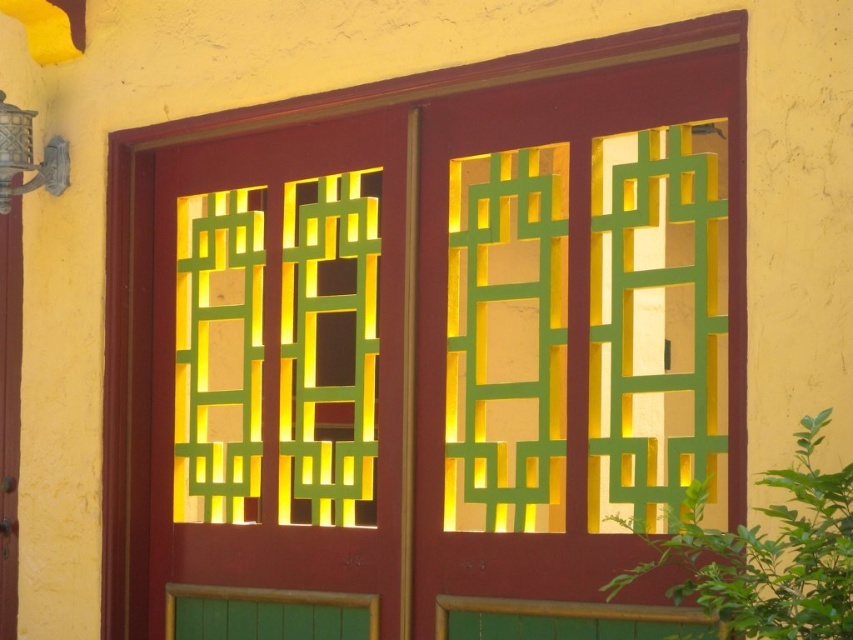
You are standing in front of the yellow wall with the wooden doors. You need to hang a small picture frame on the wall between the matte wood screen door at center and the metallic wall sconce at upper left. Is there enough space between them to place the frame?

The matte wood screen door at center is positioned under the metallic wall sconce at upper left, so there is space between them to place the frame.

You are standing in front of the red doors with yellow walls and see two points marked on the doors. The first point is at coordinate point (480,189) and the second is at point (4,179). Which point is closer to you?

Point (480,189) is in front of point (4,179), so the first point is closer to you.

You are a painter standing 5 feet away from the matte wood screen door at center. You want to reach the metallic wall sconce at upper left to clean it. Can you reach it without moving closer? Please explain your reasoning.

The distance between the matte wood screen door at center and the metallic wall sconce at upper left is 3.75 feet. Since you are already 5 feet away from the door, the sconce is 3.75 feet further away from you. Therefore, the total distance to the sconce is 5 feet plus 3.75 feet, totaling 8.75 feet. At this distance, it would be difficult to reach the sconce without moving closer.